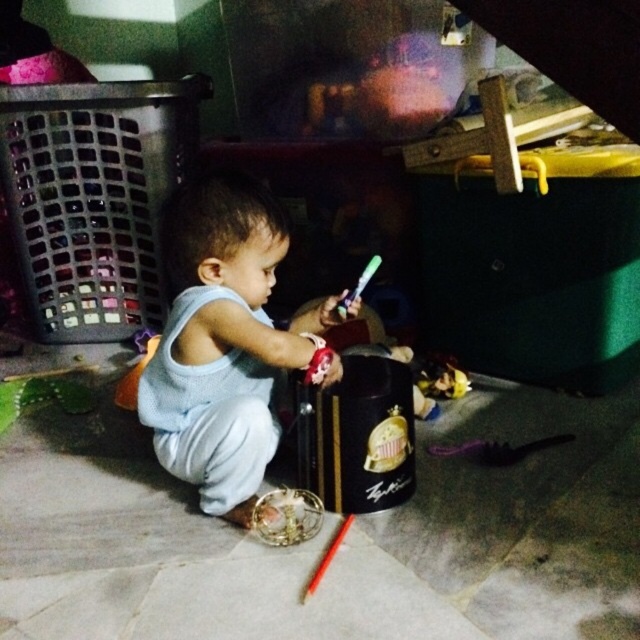
Is light blue fabric toddler at center shorter than red wooden paint brush at lower center?

No.

Which is below, light blue fabric toddler at center or red wooden paint brush at lower center?

red wooden paint brush at lower center is below.

This screenshot has height=640, width=640. In order to click on light blue fabric toddler at center in this screenshot , I will do point(225,342).

Identify the location of light blue fabric toddler at center. The image size is (640, 640). (225, 342).